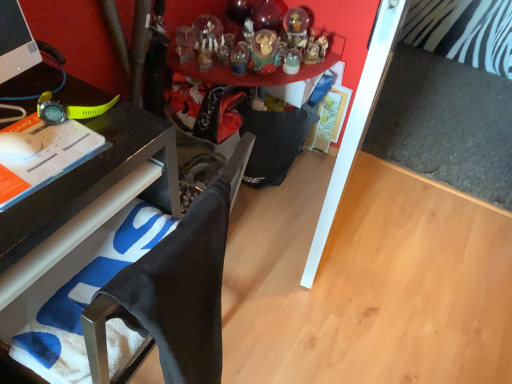
Find the location of `vacant position to the left of matte black watch at left`. vacant position to the left of matte black watch at left is located at coordinates (18, 108).